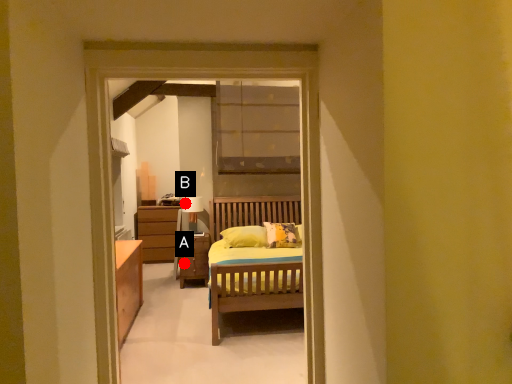
Question: Two points are circled on the image, labeled by A and B beside each circle. Which point is closer to the camera?

Choices:
 (A) A is closer
 (B) B is closer

Answer: (A)